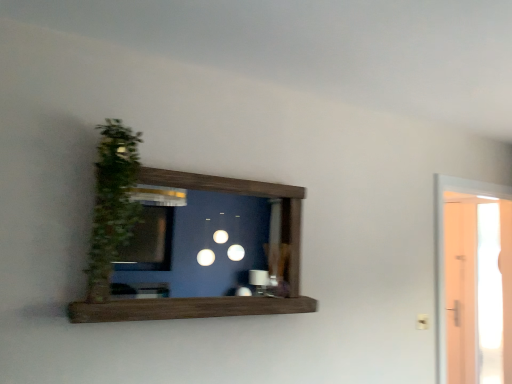
Where is `transparent glass door at right`? Image resolution: width=512 pixels, height=384 pixels. transparent glass door at right is located at coordinates (473, 281).

In order to face transparent glass door at right, should I rotate leftwards or rightwards?

It's best to rotate right around 27.254 degrees.

The height and width of the screenshot is (384, 512). Describe the element at coordinates (473, 281) in the screenshot. I see `transparent glass door at right` at that location.

Describe the element at coordinates (112, 203) in the screenshot. I see `green leafy plant at left` at that location.

This screenshot has height=384, width=512. I want to click on green leafy plant at left, so 112,203.

What is the approximate width of green leafy plant at left?

green leafy plant at left is 7.85 inches wide.

The height and width of the screenshot is (384, 512). Identify the location of transparent glass door at right. (473, 281).

Can you confirm if transparent glass door at right is positioned to the right of green leafy plant at left?

Yes, transparent glass door at right is to the right of green leafy plant at left.

Between transparent glass door at right and green leafy plant at left, which one is positioned in front?

green leafy plant at left is more forward.

Considering the positions of points (440, 214) and (101, 150), is point (440, 214) closer to camera compared to point (101, 150)?

No, (440, 214) is further to viewer.

From the image's perspective, is transparent glass door at right on green leafy plant at left?

Actually, transparent glass door at right appears below green leafy plant at left in the image.

From a real-world perspective, does transparent glass door at right stand above green leafy plant at left?

No, from a real-world perspective, transparent glass door at right is not on top of green leafy plant at left.

Considering the sizes of objects transparent glass door at right and green leafy plant at left in the image provided, who is wider, transparent glass door at right or green leafy plant at left?

transparent glass door at right.

Between transparent glass door at right and green leafy plant at left, which one has less height?

With less height is green leafy plant at left.

Considering the sizes of objects transparent glass door at right and green leafy plant at left in the image provided, who is bigger, transparent glass door at right or green leafy plant at left?

transparent glass door at right.

Choose the correct answer: Is transparent glass door at right inside green leafy plant at left or outside it?

transparent glass door at right is outside green leafy plant at left.

Based on the photo, is transparent glass door at right next to green leafy plant at left?

There is a gap between transparent glass door at right and green leafy plant at left.

Could you tell me if transparent glass door at right is facing green leafy plant at left?

No.

Image resolution: width=512 pixels, height=384 pixels. Find the location of `plant in front of the transparent glass door at right`. plant in front of the transparent glass door at right is located at coordinates (112, 203).

Between green leafy plant at left and transparent glass door at right, which one appears on the right side from the viewer's perspective?

transparent glass door at right is more to the right.

Relative to transparent glass door at right, is green leafy plant at left in front or behind?

green leafy plant at left is positioned closer to the viewer than transparent glass door at right.

Which point is more distant from viewer, (137, 222) or (468, 231)?

The point (137, 222) is farther from the camera.

From the image's perspective, is green leafy plant at left below transparent glass door at right?

Incorrect, from the image's perspective, green leafy plant at left is higher than transparent glass door at right.

From a real-world perspective, who is located lower, green leafy plant at left or transparent glass door at right?

In real-world perspective, transparent glass door at right is lower.

Which object is wider, green leafy plant at left or transparent glass door at right?

Wider between the two is transparent glass door at right.

Is green leafy plant at left taller than transparent glass door at right?

No.

Does green leafy plant at left have a larger size compared to transparent glass door at right?

No.

Is transparent glass door at right surrounded by green leafy plant at left?

Definitely not — transparent glass door at right is not inside green leafy plant at left.

Is green leafy plant at left far away from transparent glass door at right?

Yes, green leafy plant at left and transparent glass door at right are located far from each other.

Is green leafy plant at left oriented away from transparent glass door at right?

That's not correct — green leafy plant at left is not looking away from transparent glass door at right.

How different are the orientations of green leafy plant at left and transparent glass door at right in degrees?

The angle between the facing direction of green leafy plant at left and the facing direction of transparent glass door at right is 0.954 degrees.

Identify the location of glass door below the green leafy plant at left (from a real-world perspective). The image size is (512, 384). (473, 281).

Where is `plant above the transparent glass door at right (from the image's perspective)`? The image size is (512, 384). plant above the transparent glass door at right (from the image's perspective) is located at coordinates (112, 203).

At what (x,y) coordinates should I click in order to perform the action: click on glass door on the right of the green leafy plant at left. Please return your answer as a coordinate pair (x, y). This screenshot has height=384, width=512. Looking at the image, I should click on (473, 281).